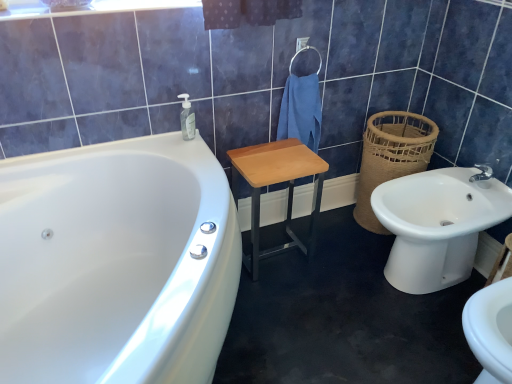
Question: Is white ceramic sink at right further to camera compared to blue cotton towel at center?

Choices:
 (A) no
 (B) yes

Answer: (A)

Question: Is white ceramic sink at right facing away from blue cotton towel at center?

Choices:
 (A) no
 (B) yes

Answer: (A)

Question: From the image's perspective, would you say white ceramic sink at right is shown under blue cotton towel at center?

Choices:
 (A) no
 (B) yes

Answer: (B)

Question: Is white ceramic sink at right positioned beyond the bounds of blue cotton towel at center?

Choices:
 (A) yes
 (B) no

Answer: (A)

Question: Does white ceramic sink at right have a greater height compared to blue cotton towel at center?

Choices:
 (A) no
 (B) yes

Answer: (B)

Question: Do you think wooden/matte step stool at center is within white glossy bathtub at left, or outside of it?

Choices:
 (A) inside
 (B) outside

Answer: (B)

Question: Considering the positions of point (310, 216) and point (202, 307), is point (310, 216) closer or farther from the camera than point (202, 307)?

Choices:
 (A) farther
 (B) closer

Answer: (A)

Question: Is wooden/matte step stool at center in front of or behind white glossy bathtub at left in the image?

Choices:
 (A) behind
 (B) front

Answer: (A)

Question: Is wooden/matte step stool at center bigger or smaller than white glossy bathtub at left?

Choices:
 (A) big
 (B) small

Answer: (B)

Question: From the image's perspective, is white glossy bathtub at left positioned above or below white ceramic sink at right?

Choices:
 (A) below
 (B) above

Answer: (A)

Question: In terms of height, does white glossy bathtub at left look taller or shorter compared to white ceramic sink at right?

Choices:
 (A) tall
 (B) short

Answer: (A)

Question: Does point (18, 306) appear closer or farther from the camera than point (410, 233)?

Choices:
 (A) farther
 (B) closer

Answer: (B)

Question: Is white glossy bathtub at left inside or outside of white ceramic sink at right?

Choices:
 (A) outside
 (B) inside

Answer: (A)

Question: Would you say wooden/matte step stool at center is inside or outside blue cotton towel at center?

Choices:
 (A) inside
 (B) outside

Answer: (B)

Question: Is point (258, 200) positioned closer to the camera than point (289, 114)?

Choices:
 (A) closer
 (B) farther

Answer: (B)